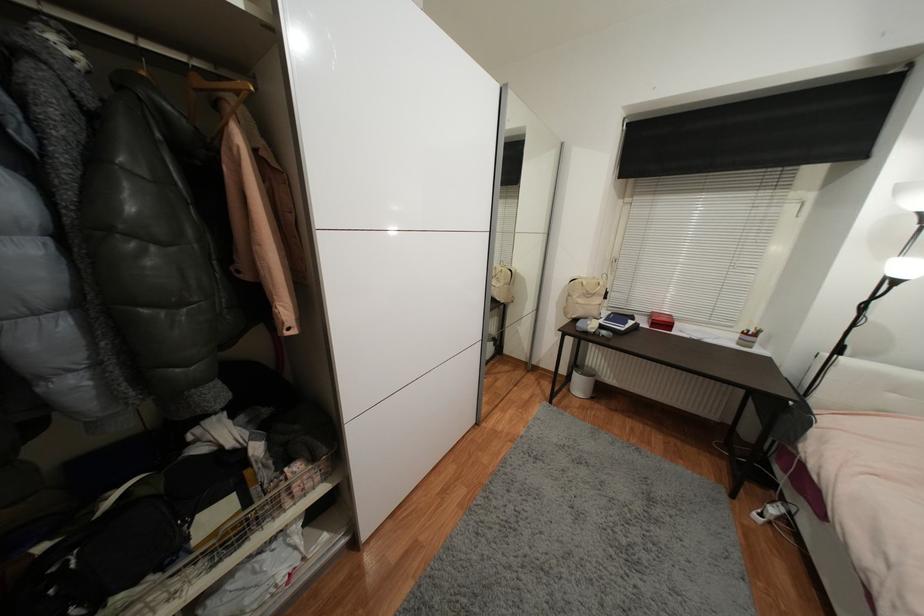
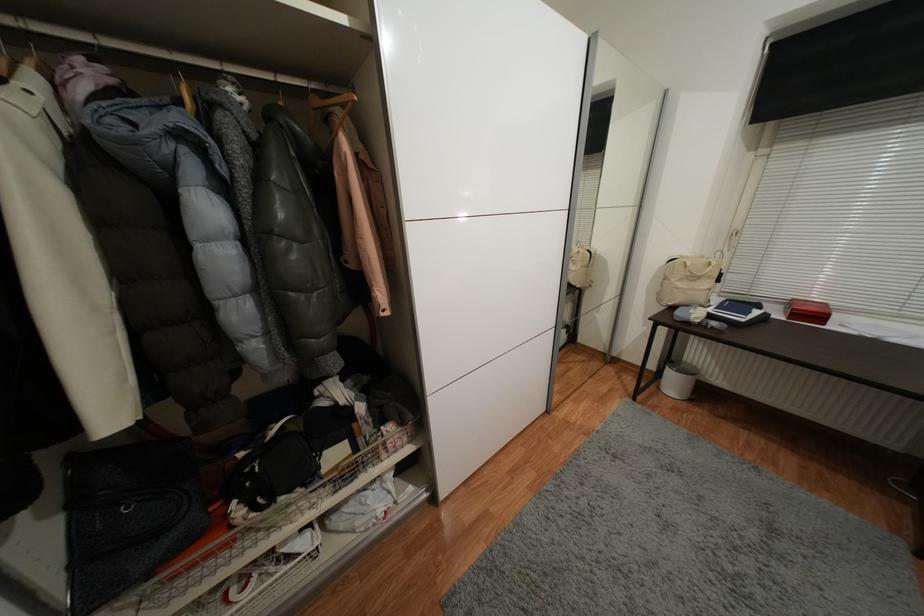
Find the pixel in the second image that matches (x=673, y=326) in the first image.

(824, 318)